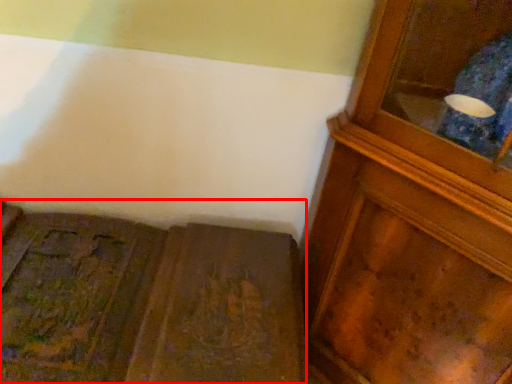
Question: Where is furniture (annotated by the red box) located in relation to cupboard in the image?

Choices:
 (A) right
 (B) left

Answer: (B)